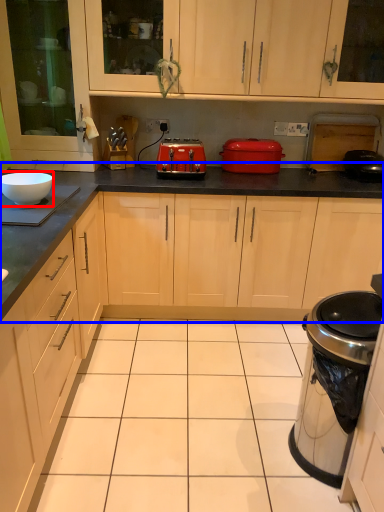
Question: Which point is closer to the camera, bowl (highlighted by a red box) or countertop (highlighted by a blue box)?

Choices:
 (A) bowl
 (B) countertop

Answer: (A)